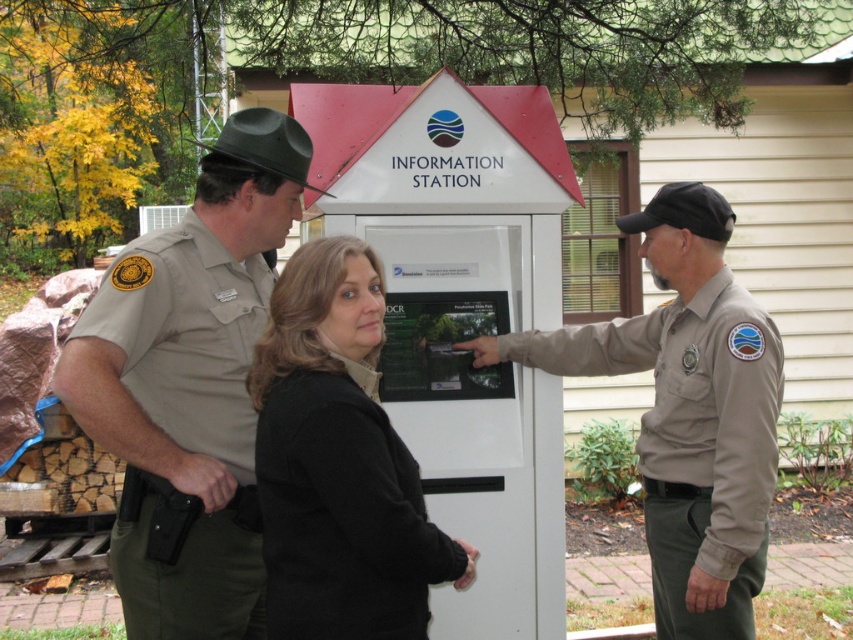
Question: Is black fleece jacket at center wider than tan/cotton shirt at center?

Choices:
 (A) yes
 (B) no

Answer: (B)

Question: Is black leather jacket at center to the left of khaki uniform at center from the viewer's perspective?

Choices:
 (A) no
 (B) yes

Answer: (A)

Question: Which point is closer to the camera?

Choices:
 (A) (294, 376)
 (B) (195, 515)

Answer: (A)

Question: Where is khaki uniform at center located in relation to tan/cotton shirt at center in the image?

Choices:
 (A) above
 (B) below

Answer: (A)

Question: Which point is farther from the camera taking this photo?

Choices:
 (A) (169, 612)
 (B) (753, 417)
 (C) (750, 634)

Answer: (C)

Question: Which of the following is the closest to the observer?

Choices:
 (A) tan/cotton shirt at center
 (B) black leather jacket at center
 (C) khaki uniform at center

Answer: (C)